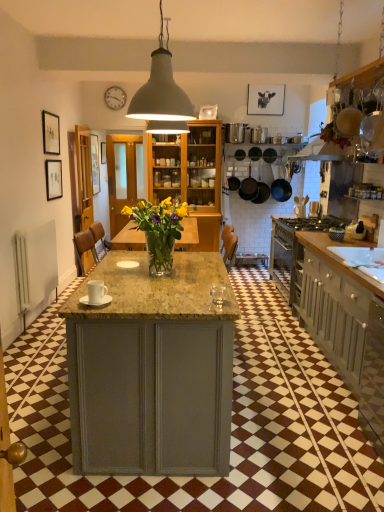
Question: In which direction should I rotate to look at matte black cow portrait at upper center, the 4th picture frame when ordered from bottom to top?

Choices:
 (A) right
 (B) left

Answer: (A)

Question: Is matte black picture frame at upper left, marked as the 2th picture frame in a bottom-to-top arrangement, completely or partially outside of white glossy sink at right?

Choices:
 (A) yes
 (B) no

Answer: (A)

Question: Can you confirm if matte black picture frame at upper left, the 2th picture frame from the left, is positioned to the left of white glossy sink at right?

Choices:
 (A) yes
 (B) no

Answer: (A)

Question: Could you tell me if matte black picture frame at upper left, marked as the 1th picture frame in a front-to-back arrangement, is turned towards white glossy sink at right?

Choices:
 (A) no
 (B) yes

Answer: (A)

Question: Is matte black picture frame at upper left, marked as the 1th picture frame in a front-to-back arrangement, bigger than white glossy sink at right?

Choices:
 (A) no
 (B) yes

Answer: (A)

Question: Is matte black picture frame at upper left, marked as the 2th picture frame in a bottom-to-top arrangement, shorter than white glossy sink at right?

Choices:
 (A) no
 (B) yes

Answer: (A)

Question: Is matte black picture frame at upper left, which appears as the 4th picture frame when viewed from the back, to the right of white glossy sink at right from the viewer's perspective?

Choices:
 (A) no
 (B) yes

Answer: (A)

Question: Would you say white wooden clock at upper center is a long distance from matte black picture frame at left, which is the 4th picture frame in top-to-bottom order?

Choices:
 (A) yes
 (B) no

Answer: (A)

Question: From a real-world perspective, is white wooden clock at upper center beneath matte black picture frame at left, which is the first picture frame from left to right?

Choices:
 (A) no
 (B) yes

Answer: (A)

Question: Is white wooden clock at upper center aimed at matte black picture frame at left, which is the 4th picture frame in top-to-bottom order?

Choices:
 (A) yes
 (B) no

Answer: (B)

Question: Is white wooden clock at upper center not inside matte black picture frame at left, which is the 4th picture frame in top-to-bottom order?

Choices:
 (A) no
 (B) yes

Answer: (B)

Question: Is matte black picture frame at left, the third picture frame in the back-to-front sequence, inside white wooden clock at upper center?

Choices:
 (A) no
 (B) yes

Answer: (A)

Question: From a real-world perspective, is white wooden clock at upper center on matte black picture frame at left, the third picture frame in the back-to-front sequence?

Choices:
 (A) no
 (B) yes

Answer: (B)

Question: Does matte black frying pan at upper right, the 1th frying pan from the front, appear on the left side of matte black picture frame at left, the third picture frame in the back-to-front sequence?

Choices:
 (A) no
 (B) yes

Answer: (A)